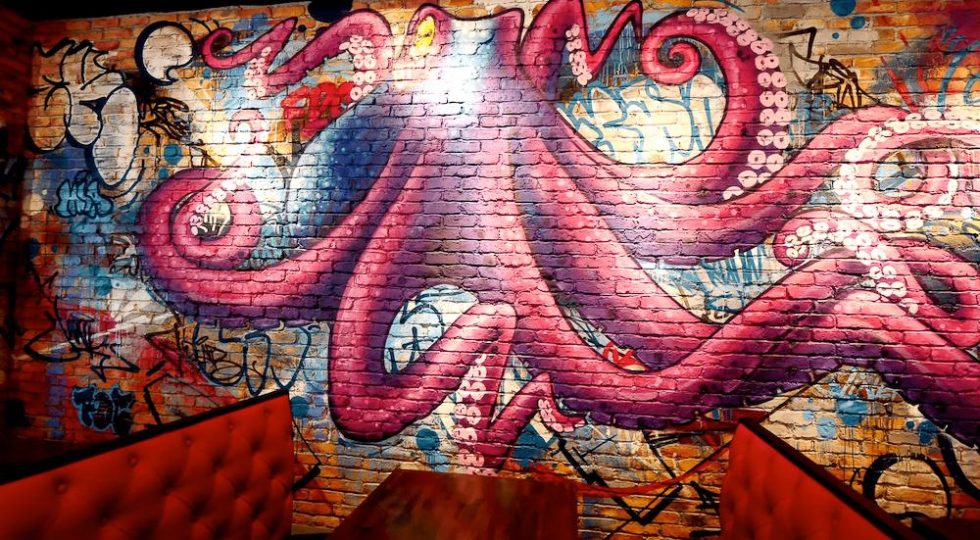
Image resolution: width=980 pixels, height=540 pixels. What are the coordinates of `back of seat` in the screenshot? It's located at (229, 476), (776, 492).